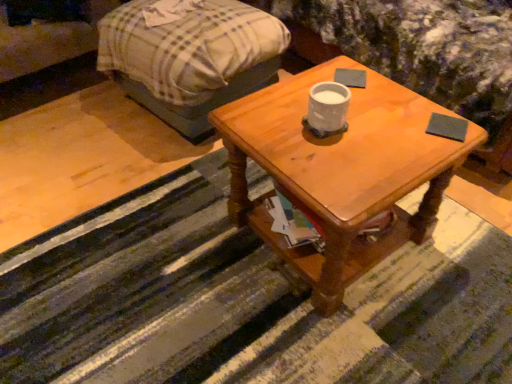
At what (x,y) coordinates should I click in order to perform the action: click on vacant space behind dark gray matte pad at upper right, positioned as the second pad in top-to-bottom order. Please return your answer as a coordinate pair (x, y). The width and height of the screenshot is (512, 384). Looking at the image, I should click on (412, 101).